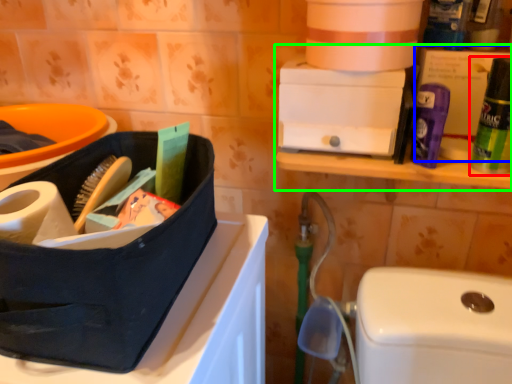
Question: Considering the real-world distances, which object is farthest from cleaning product (highlighted by a red box)? storage box (highlighted by a blue box) or shelf (highlighted by a green box)?

Choices:
 (A) storage box
 (B) shelf

Answer: (B)